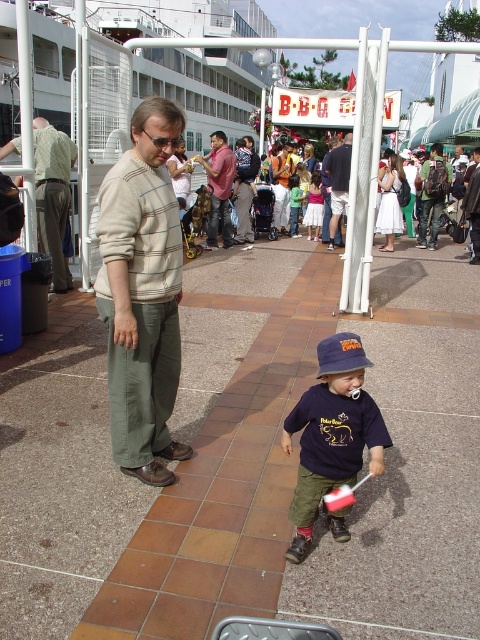
Question: Can you confirm if light green textured shirt at left is thinner than light brown sweater at center?

Choices:
 (A) no
 (B) yes

Answer: (A)

Question: Which point is farther to the camera?

Choices:
 (A) (339, 198)
 (B) (101, 202)

Answer: (A)

Question: Is light green textured shirt at left in front of light brown sweater at center?

Choices:
 (A) yes
 (B) no

Answer: (A)

Question: Which is nearer to the green cotton shirt at center?

Choices:
 (A) light brown sweater at center
 (B) light beige striped sweater at center

Answer: (A)

Question: Can you confirm if light beige striped sweater at center is positioned above matte pink shirt at center?

Choices:
 (A) yes
 (B) no

Answer: (B)

Question: Which object is farther from the camera taking this photo?

Choices:
 (A) matte pink shirt at center
 (B) brown tile pavement at center
 (C) light beige striped sweater at center

Answer: (A)